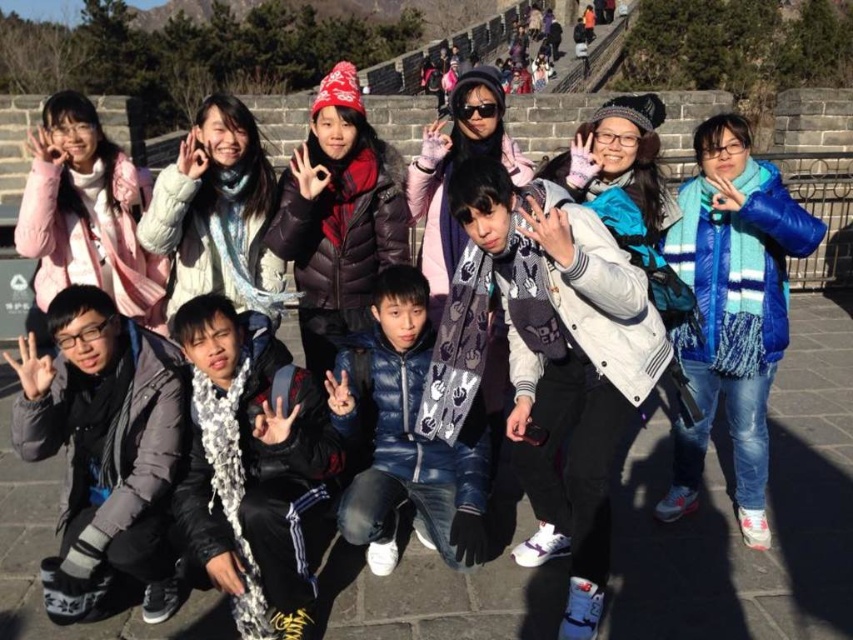
Does white textured scarf at center come in front of blue down jacket at center?

Yes, white textured scarf at center is in front of blue down jacket at center.

Does white textured scarf at center have a lesser width compared to blue down jacket at center?

Indeed, white textured scarf at center has a lesser width compared to blue down jacket at center.

Is point (236, 566) less distant than point (403, 488)?

That is True.

The image size is (853, 640). Identify the location of white textured scarf at center. (251, 467).

Can you confirm if gray woolen sweater at lower left is thinner than white matte jacket at center?

In fact, gray woolen sweater at lower left might be wider than white matte jacket at center.

Is gray woolen sweater at lower left closer to camera compared to white matte jacket at center?

Yes, gray woolen sweater at lower left is closer to the viewer.

Who is more forward, (96, 317) or (181, 195)?

Point (96, 317)

Locate an element on the screen. Image resolution: width=853 pixels, height=640 pixels. gray woolen sweater at lower left is located at coordinates (103, 449).

Does matte pink jacket at upper left appear over white matte jacket at center?

Indeed, matte pink jacket at upper left is positioned over white matte jacket at center.

Which is more to the left, matte pink jacket at upper left or white matte jacket at center?

From the viewer's perspective, matte pink jacket at upper left appears more on the left side.

You are a GUI agent. You are given a task and a screenshot of the screen. Output one action in this format:
    pyautogui.click(x=<x>, y=<y>)
    Task: Click on the matte pink jacket at upper left
    The height and width of the screenshot is (640, 853).
    Given the screenshot: What is the action you would take?
    pyautogui.click(x=86, y=212)